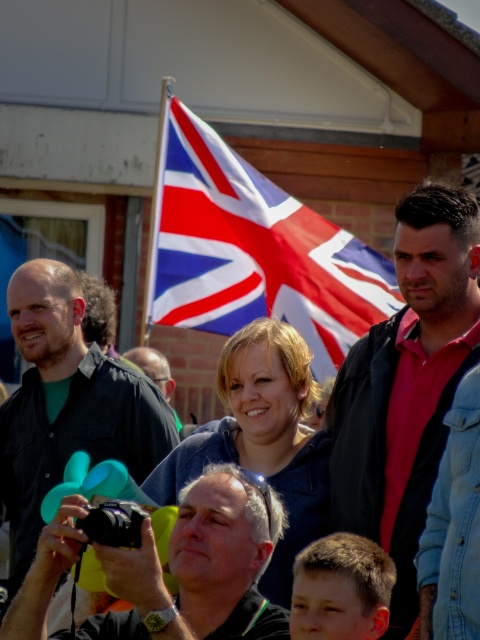
You are standing at the back of the group and want to hand the red and white fabric flag at center to the person wearing the matte black shirt at left. Which direction should you move to reach them?

You should move towards the matte black shirt at left because the red and white fabric flag at center is closer to you than the matte black shirt at left, so moving towards the left will allow you to reach the person wearing the matte black shirt at left.

You are standing at the camera position and want to know which of the two points, point (389,420) or point (254,291), is nearer to you. Can you determine this?

Point (389,420) is closer to the camera than point (254,291), so it is nearer to you.